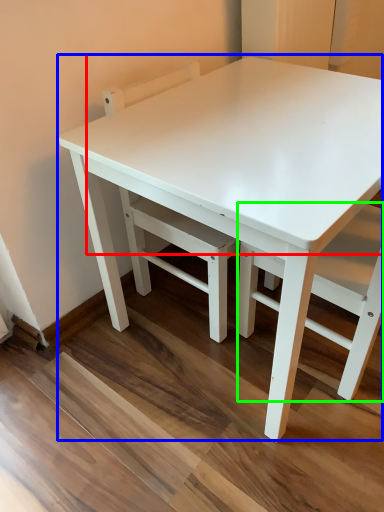
Question: Which object is positioned closest to table top (highlighted by a red box)? Select from table (highlighted by a blue box) and chair (highlighted by a green box).

Choices:
 (A) table
 (B) chair

Answer: (A)